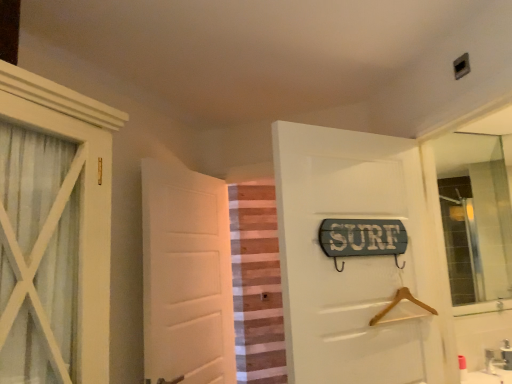
Question: From the image's perspective, is white matte door at center, the 1th door in the left-to-right sequence, located above or below wooden sign at center, the first door from the front?

Choices:
 (A) above
 (B) below

Answer: (B)

Question: From their relative heights in the image, would you say white matte door at center, placed as the second door when sorted from front to back, is taller or shorter than wooden sign at center, which appears as the 2th door when viewed from the left?

Choices:
 (A) tall
 (B) short

Answer: (A)

Question: Estimate the real-world distances between objects in this image. Which object is farther from the striped fabric curtain at center?

Choices:
 (A) wooden sign at center, which appears as the 2th door when viewed from the left
 (B) clear glass mirror at upper right
 (C) white matte door at center, the 1th door in the left-to-right sequence

Answer: (A)

Question: Considering the real-world distances, which object is closest to the white matte door at center, the 1th door in the left-to-right sequence?

Choices:
 (A) clear glass mirror at upper right
 (B) wooden sign at center, which appears as the 2th door when viewed from the left
 (C) striped fabric curtain at center

Answer: (B)